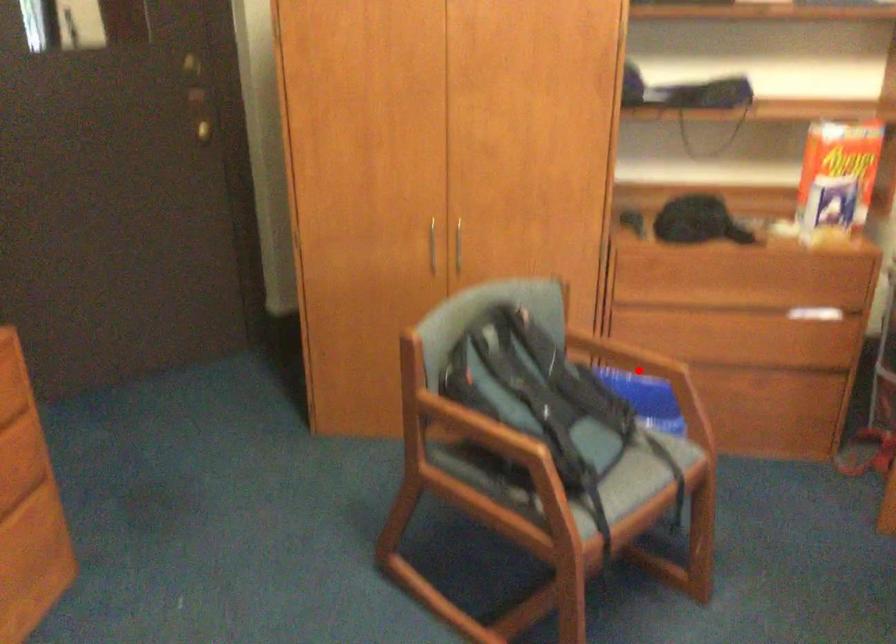
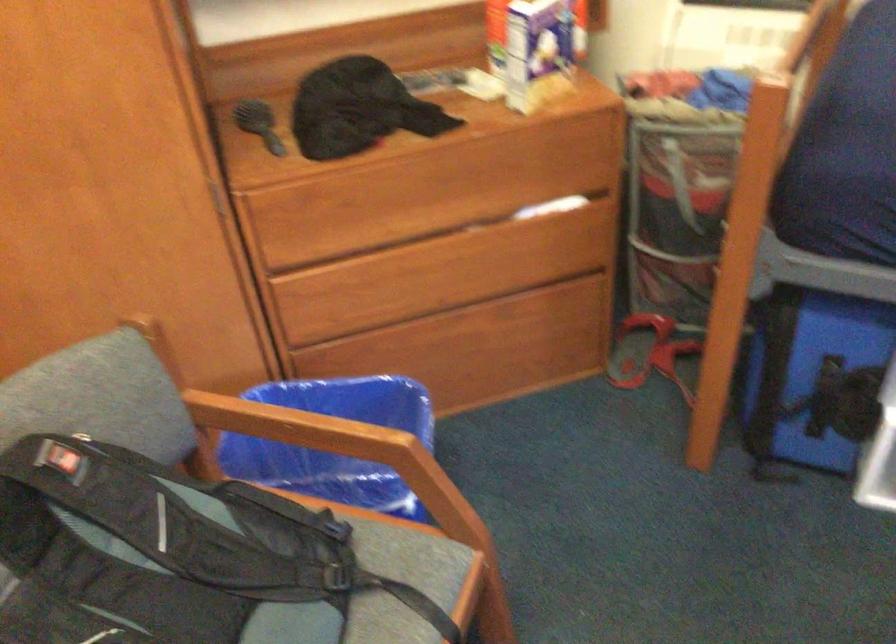
Question: I am providing you with two images of the same scene from different viewpoints. A red point is shown in image1. For the corresponding object point in image2, is it positioned nearer or farther from the camera?

Choices:
 (A) Nearer
 (B) Farther

Answer: (A)